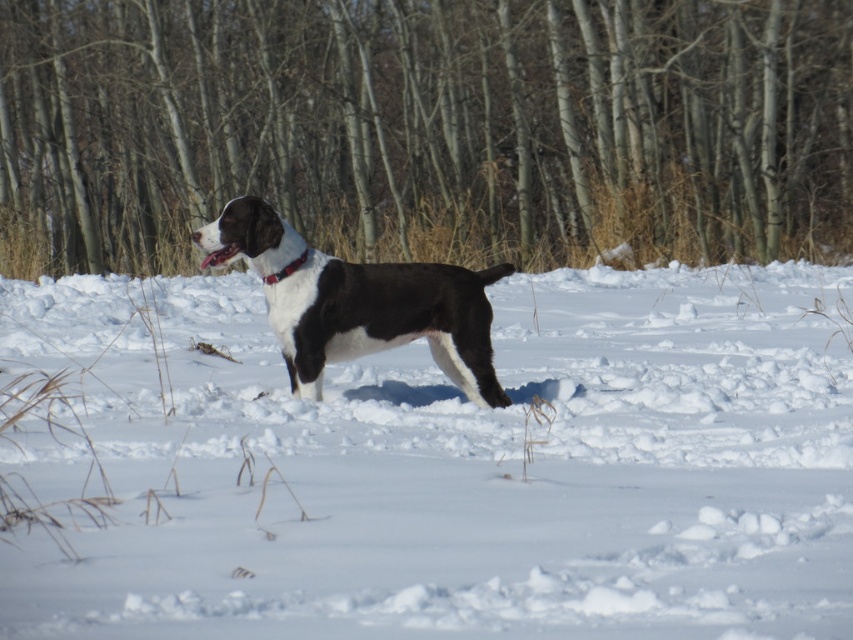
Does white fluffy snow at center have a lesser height compared to red leather collar at center?

In fact, white fluffy snow at center may be taller than red leather collar at center.

Does white fluffy snow at center have a smaller size compared to red leather collar at center?

Incorrect, white fluffy snow at center is not smaller in size than red leather collar at center.

In the scene shown: Who is more forward, (225,586) or (305,250)?

Point (225,586) is more forward.

The width and height of the screenshot is (853, 640). I want to click on white fluffy snow at center, so click(457, 467).

Is white fluffy snow at center taller than brown bark tree at center?

No, white fluffy snow at center is not taller than brown bark tree at center.

Can you confirm if white fluffy snow at center is shorter than brown bark tree at center?

Yes.

Which is in front, point (94, 614) or point (349, 131)?

Point (94, 614) is more forward.

Where is `white fluffy snow at center`? The width and height of the screenshot is (853, 640). white fluffy snow at center is located at coordinates (457, 467).

Is point (692, 621) less distant than point (311, 282)?

That is True.

In the scene shown: Is white fluffy snow at center taller than black matte dog at center?

Yes.

At what (x,y) coordinates should I click in order to perform the action: click on white fluffy snow at center. Please return your answer as a coordinate pair (x, y). Looking at the image, I should click on (457, 467).

At what (x,y) coordinates should I click in order to perform the action: click on white fluffy snow at center. Please return your answer as a coordinate pair (x, y). The height and width of the screenshot is (640, 853). Looking at the image, I should click on (457, 467).